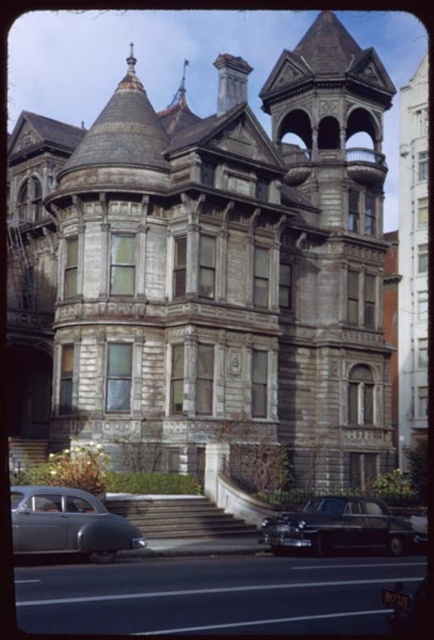
Question: Which object appears closest to the camera in this image?

Choices:
 (A) silver metallic car at lower left
 (B) shiny black sedan at lower center

Answer: (A)

Question: Which point is closer to the camera?

Choices:
 (A) (288, 76)
 (B) (40, 547)
 (C) (309, 502)

Answer: (B)

Question: Does stone mansion at center have a smaller size compared to shiny black sedan at lower center?

Choices:
 (A) no
 (B) yes

Answer: (A)

Question: Based on their relative distances, which object is nearer to the stone mansion at center?

Choices:
 (A) shiny black sedan at lower center
 (B) silver metallic car at lower left

Answer: (A)

Question: Can you confirm if stone mansion at center is thinner than shiny black sedan at lower center?

Choices:
 (A) yes
 (B) no

Answer: (B)

Question: Does silver metallic car at lower left appear on the right side of shiny black sedan at lower center?

Choices:
 (A) yes
 (B) no

Answer: (B)